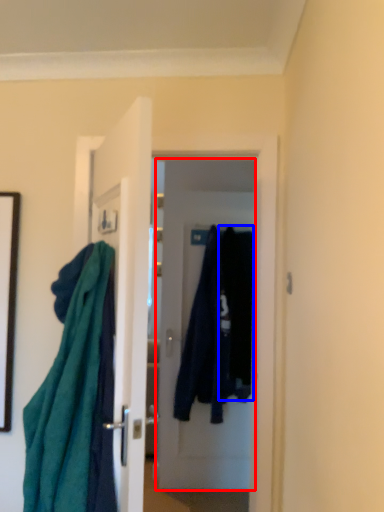
Question: Among these objects, which one is nearest to the camera, door (highlighted by a red box) or clothing (highlighted by a blue box)?

Choices:
 (A) door
 (B) clothing

Answer: (B)